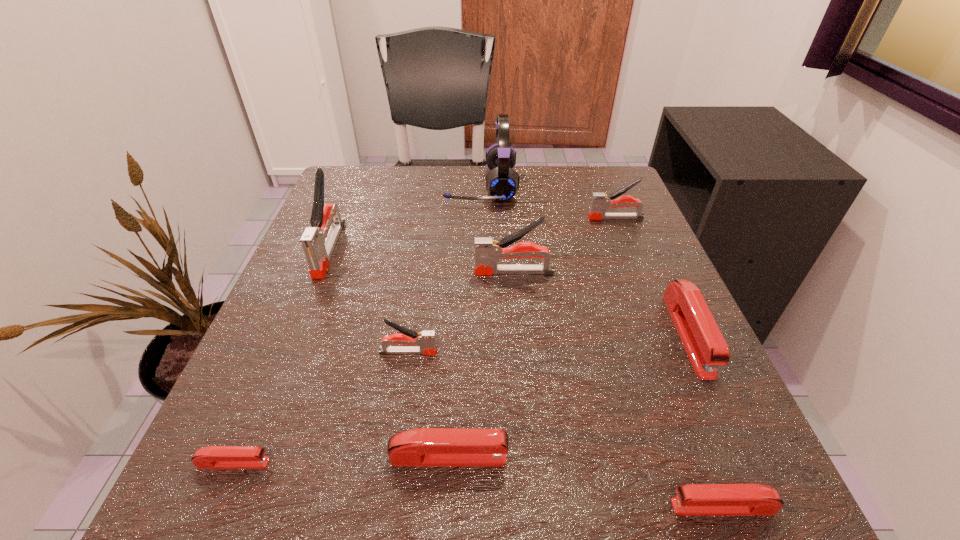
Identify the location of headset. (502, 182).

You are a GUI agent. You are given a task and a screenshot of the screen. Output one action in this format:
    pyautogui.click(x=<x>, y=<y>)
    Task: Click on the tallest stapler
    This screenshot has width=960, height=540.
    Given the screenshot: What is the action you would take?
    pyautogui.click(x=318, y=244)

You are a GUI agent. You are given a task and a screenshot of the screen. Output one action in this format:
    pyautogui.click(x=<x>, y=<y>)
    Task: Click on the biggest gray stapler
    This screenshot has width=960, height=540.
    Given the screenshot: What is the action you would take?
    pyautogui.click(x=318, y=244)

Image resolution: width=960 pixels, height=540 pixels. What are the coordinates of `the third tallest object` in the screenshot? It's located at (487, 251).

What are the coordinates of `the seventh shortest stapler` in the screenshot? It's located at (487, 251).

I want to click on the third biggest gray stapler, so 600,202.

Locate an element on the screen. the rightmost gray stapler is located at coordinates click(600, 202).

Locate an element on the screen. the smallest gray stapler is located at coordinates (426, 340).

Where is `the nearest gray stapler`? Image resolution: width=960 pixels, height=540 pixels. the nearest gray stapler is located at coordinates (426, 340).

Locate an element on the screen. The width and height of the screenshot is (960, 540). the farthest red stapler is located at coordinates (702, 339).